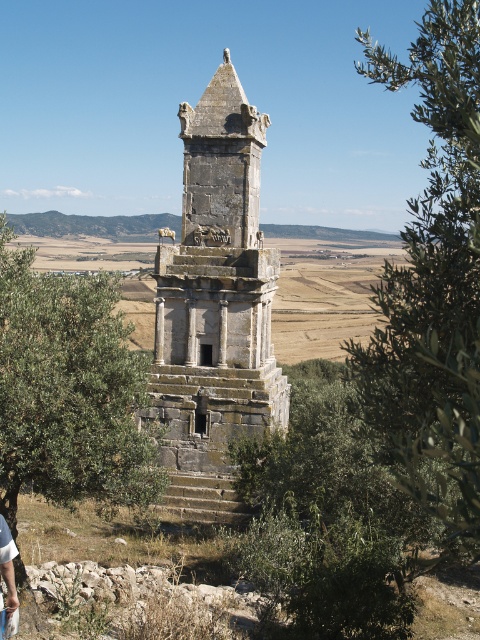
Does green leafy tree at center right appear on the right side of stone tower at center?

Indeed, green leafy tree at center right is positioned on the right side of stone tower at center.

Based on the photo, can you confirm if green leafy tree at center right is wider than stone tower at center?

Correct, the width of green leafy tree at center right exceeds that of stone tower at center.

Does point (451, 205) come behind point (231, 408)?

That is False.

Image resolution: width=480 pixels, height=640 pixels. Identify the location of green leafy tree at center right. (432, 284).

Can you confirm if green leafy tree at center is positioned to the left of light brown leather pants at lower left?

Result: No, green leafy tree at center is not to the left of light brown leather pants at lower left.

Between green leafy tree at center and light brown leather pants at lower left, which one appears on the left side from the viewer's perspective?

Positioned to the left is light brown leather pants at lower left.

Is point (19, 301) positioned in front of point (0, 570)?

That is False.

Identify the location of green leafy tree at center. The image size is (480, 640). (68, 390).

Between stone tower at center and green leafy tree at center, which one appears on the left side from the viewer's perspective?

green leafy tree at center

Can you confirm if stone tower at center is taller than green leafy tree at center?

Indeed, stone tower at center has a greater height compared to green leafy tree at center.

The height and width of the screenshot is (640, 480). In order to click on stone tower at center in this screenshot , I will do `click(215, 307)`.